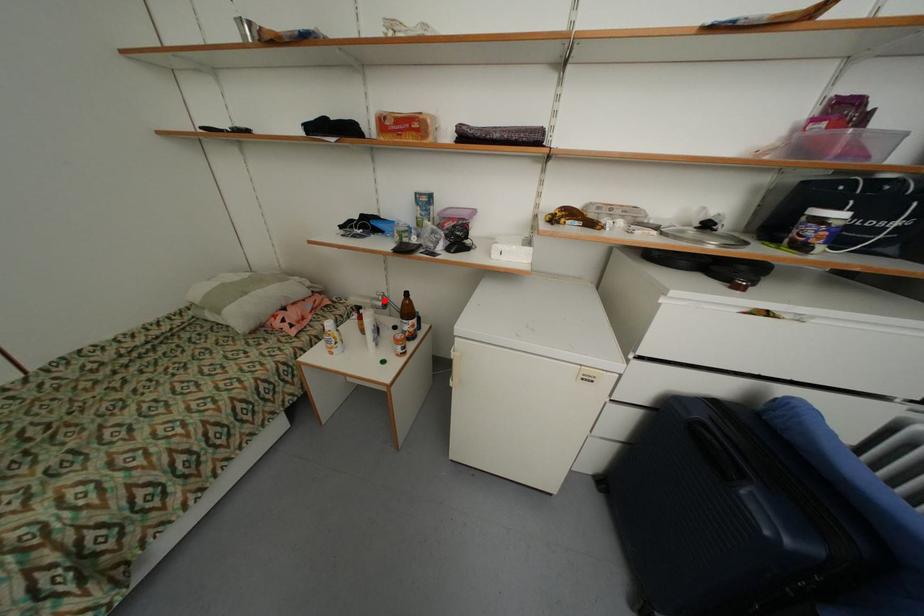
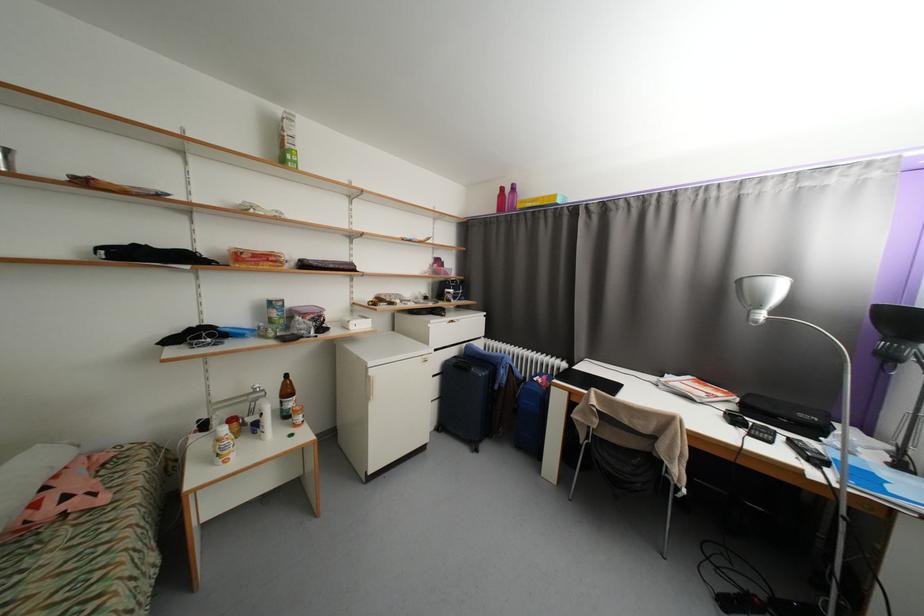
Question: I am providing you with two images of the same scene from different viewpoints. A red point is marked on the first image. Is the red point's position out of view in image 2?

Choices:
 (A) Yes
 (B) No

Answer: (B)